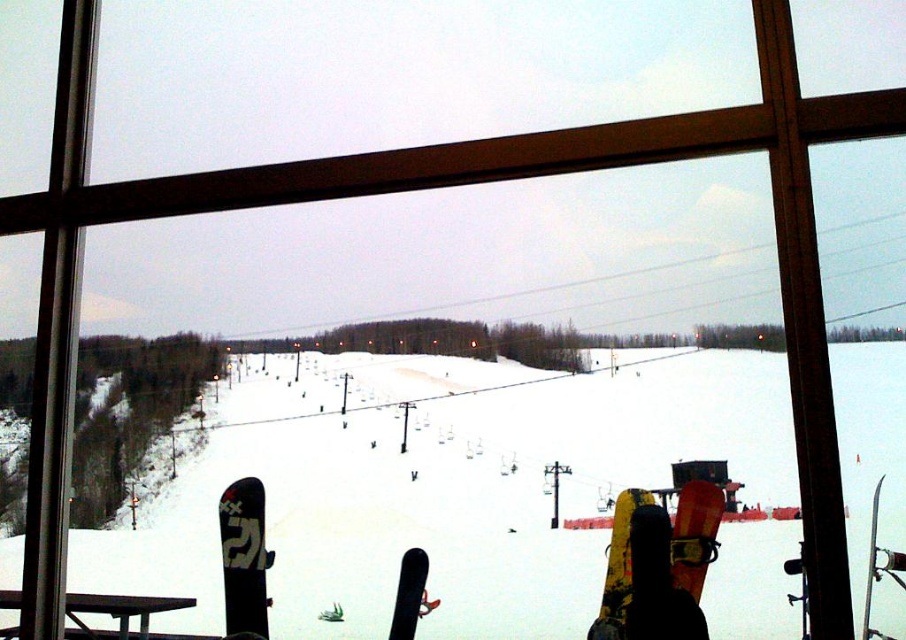
Between point (678, 584) and point (630, 529), which one is positioned in front?

Point (678, 584)

Can you confirm if yellow matte snowboard at lower center is wider than yellow matte snowboard at center?

Indeed, yellow matte snowboard at lower center has a greater width compared to yellow matte snowboard at center.

You are a GUI agent. You are given a task and a screenshot of the screen. Output one action in this format:
    pyautogui.click(x=<x>, y=<y>)
    Task: Click on the yellow matte snowboard at lower center
    Image resolution: width=906 pixels, height=640 pixels.
    Given the screenshot: What is the action you would take?
    pyautogui.click(x=657, y=582)

This screenshot has width=906, height=640. In order to click on yellow matte snowboard at lower center in this screenshot , I will do `click(657, 582)`.

The image size is (906, 640). Describe the element at coordinates (440, 486) in the screenshot. I see `white matte snow at center` at that location.

Between white matte snow at center and black matte snowboard at center, which one has more height?

white matte snow at center is taller.

Describe the element at coordinates (440, 486) in the screenshot. I see `white matte snow at center` at that location.

What are the coordinates of `white matte snow at center` in the screenshot? It's located at (440, 486).

Does matte black snowboard at lower left appear on the left side of black matte snowboard at center?

Indeed, matte black snowboard at lower left is positioned on the left side of black matte snowboard at center.

Is matte black snowboard at lower left thinner than black matte snowboard at center?

Incorrect, matte black snowboard at lower left's width is not less than black matte snowboard at center's.

This screenshot has width=906, height=640. I want to click on matte black snowboard at lower left, so click(x=244, y=557).

Image resolution: width=906 pixels, height=640 pixels. I want to click on matte black snowboard at lower left, so click(244, 557).